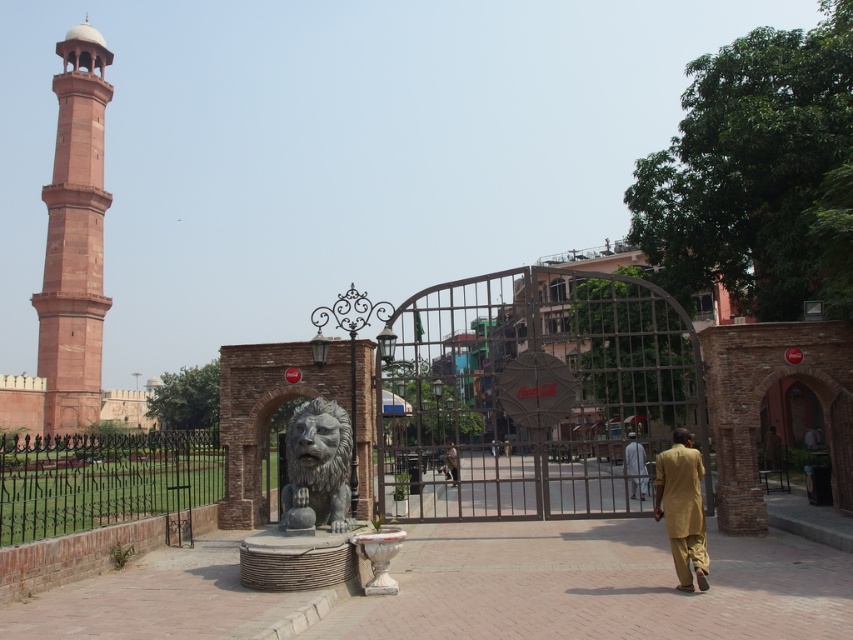
You are a visitor at the site and want to take a photo of the bronze lion statue at center without the black wrought iron fence at lower left appearing in the background. Is the fence large enough to block the view of the statue?

The black wrought iron fence at lower left is larger in size than bronze lion statue at center, so it may block the view of the statue depending on the distance and angle. To ensure the fence doesn not appear, move closer to the statue or adjust your angle to frame it without the fence.

You are a visitor at this historical site and need to take a photo of the bronze lion statue at center without the black wrought iron fence at lower left appearing in the background. Is the fence taller than the statue, making it likely to block the view?

The black wrought iron fence at lower left is taller than bronze lion statue at center, so it may block the view of the statue if positioned behind it in the photo.

You are a photographer trying to capture both the light brown cotton shirt at lower right and the light brown fabric shirt at center in a single frame. Which shirt should you focus on first to ensure both are in the shot?

The light brown cotton shirt at lower right is positioned over the light brown fabric shirt at center, so focusing on the light brown cotton shirt at lower right first will ensure both are visible in the frame.